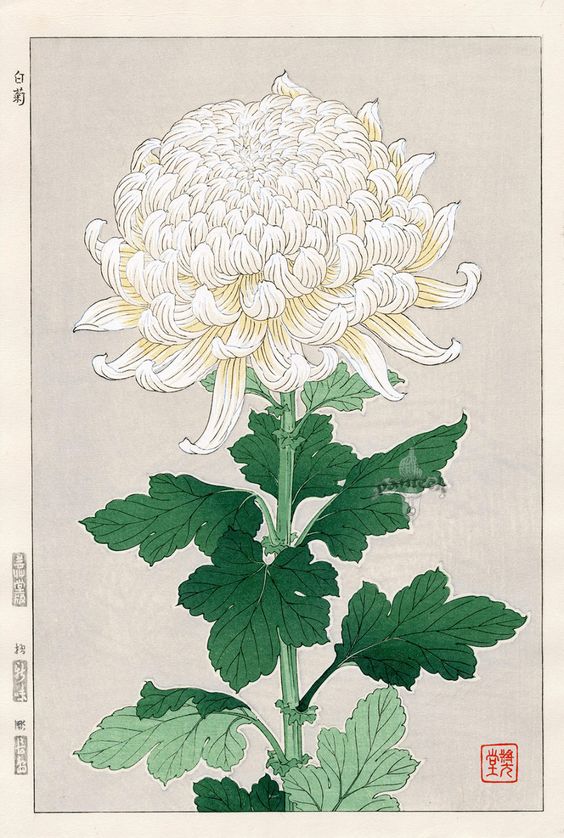
The height and width of the screenshot is (838, 564). What are the coordinates of `green plant stem` in the screenshot? It's located at (290, 678), (289, 483).